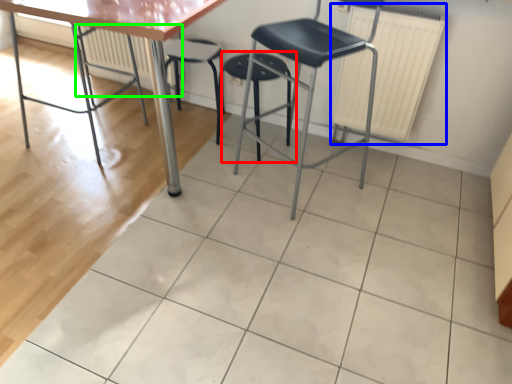
Question: Which object is positioned farthest from stool (highlighted by a red box)? Select from radiator (highlighted by a blue box) and radiator (highlighted by a green box).

Choices:
 (A) radiator
 (B) radiator

Answer: (B)